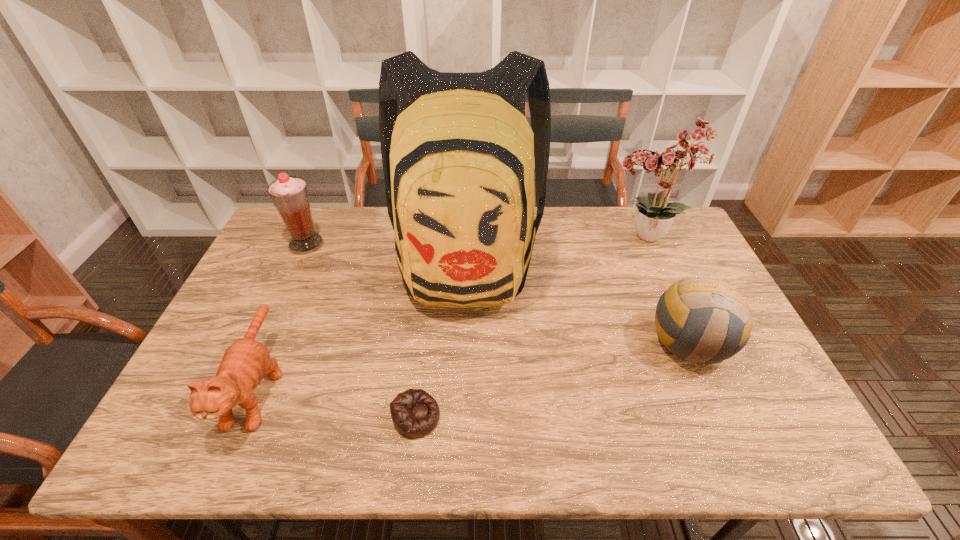
Where is `object that is the fourth closest to the smoothie`? The width and height of the screenshot is (960, 540). object that is the fourth closest to the smoothie is located at coordinates (654, 215).

Select which object appears as the closest to the volleyball. Please provide its 2D coordinates. Your answer should be formatted as a tuple, i.e. [(x, y)], where the tuple contains the x and y coordinates of a point satisfying the conditions above.

[(458, 153)]

The image size is (960, 540). I want to click on free space that satisfies the following two spatial constraints: 1. on the front-facing side of the backpack; 2. on the right side of the volleyball, so click(x=463, y=342).

Where is `free space that satisfies the following two spatial constraints: 1. on the face of the cat; 2. on the left side of the shortest object`? The image size is (960, 540). free space that satisfies the following two spatial constraints: 1. on the face of the cat; 2. on the left side of the shortest object is located at coordinates click(x=245, y=417).

Find the location of a particular element. vacant space that satisfies the following two spatial constraints: 1. on the front-facing side of the second tallest object; 2. on the front-facing side of the backpack is located at coordinates (657, 262).

The width and height of the screenshot is (960, 540). Find the location of `free spot that satisfies the following two spatial constraints: 1. on the face of the shortest object; 2. on the left side of the cat`. free spot that satisfies the following two spatial constraints: 1. on the face of the shortest object; 2. on the left side of the cat is located at coordinates (245, 417).